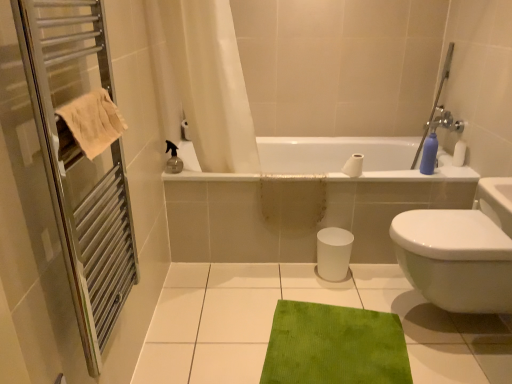
This screenshot has width=512, height=384. Identify the location of vacant area that lies to the right of blue matte bottle at upper right. (448, 174).